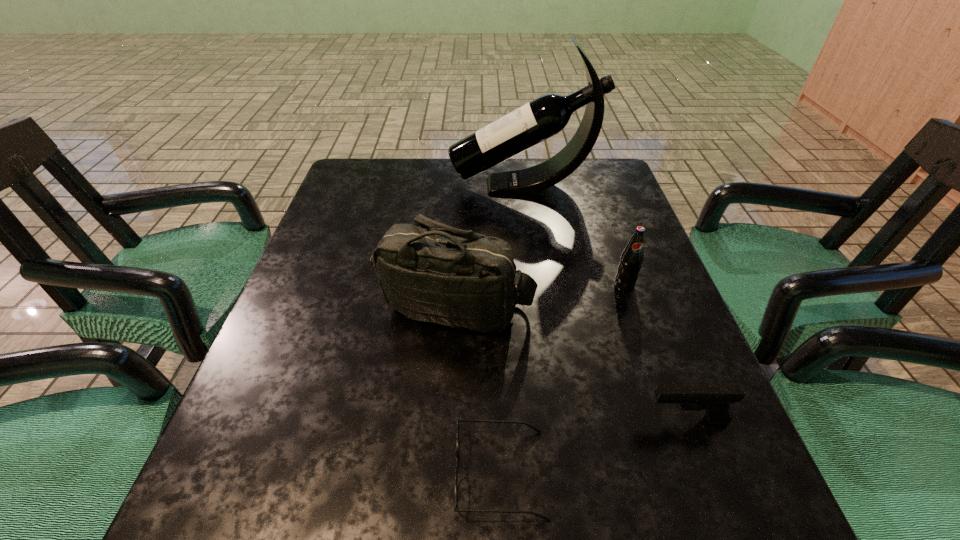
This screenshot has height=540, width=960. Identify the location of vacant space that's between the fourth tallest object and the pop. (655, 353).

Locate an element on the screen. vacant space that's between the third shortest object and the shoulder bag is located at coordinates (540, 296).

Find the location of `free space between the fourth shortest object and the fourth farthest object`. free space between the fourth shortest object and the fourth farthest object is located at coordinates (571, 363).

This screenshot has height=540, width=960. I want to click on vacant area that lies between the fourth farthest object and the pop, so click(655, 353).

In order to click on free point between the third shortest object and the second shortest object in this screenshot , I will do `click(655, 353)`.

You are a GUI agent. You are given a task and a screenshot of the screen. Output one action in this format:
    pyautogui.click(x=<x>, y=<y>)
    Task: Click on the vacant space that is in between the shortest object and the farthest object
    This screenshot has height=540, width=960.
    Given the screenshot: What is the action you would take?
    pyautogui.click(x=512, y=329)

Find the location of a particular element. unoccupied position between the shortest object and the shoulder bag is located at coordinates (478, 390).

Identify which object is the fourth closest to the shortest object. Please provide its 2D coordinates. Your answer should be formatted as a tuple, i.e. [(x, y)], where the tuple contains the x and y coordinates of a point satisfying the conditions above.

[(547, 115)]

The image size is (960, 540). Find the location of `object that is the fourth nearest to the tallest object`. object that is the fourth nearest to the tallest object is located at coordinates (459, 420).

The image size is (960, 540). What are the coordinates of `vacant position in the image that satisfies the following two spatial constraints: 1. on the front label of the pop; 2. on the front-facing side of the nearest object` in the screenshot? It's located at (688, 474).